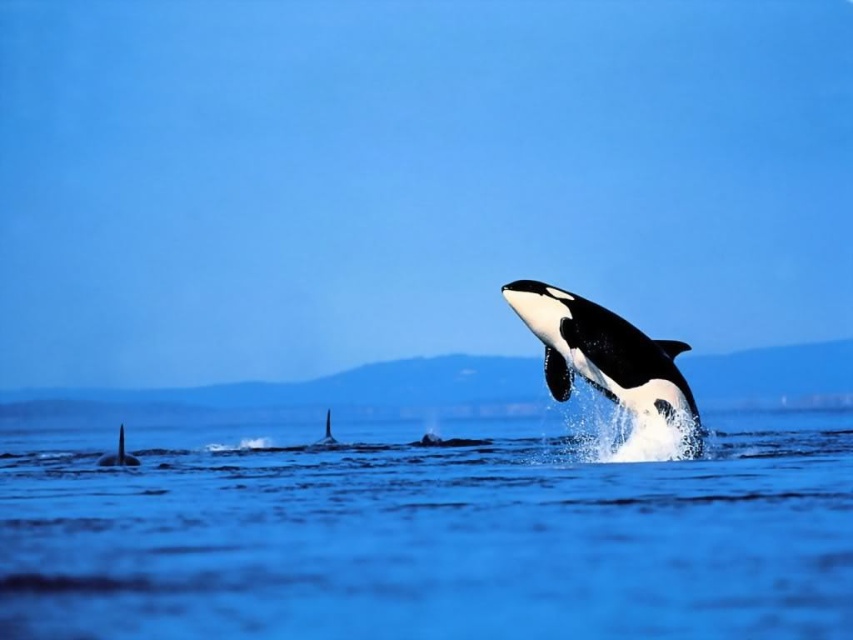
You are a marine biologist observing the orcas in the image. You notice the blue water at center and the black smooth fin at left. Which object is located above the other?

The blue water at center is positioned over the black smooth fin at left, meaning the water is above the fin.

You are a marine biologist observing the orcas in the image. You notice two points marked on the orcas. Which point is closer to the observer? The points are point (132, 456) and point (329, 438).

Point (132, 456) is in front of point (329, 438), so it is closer to the observer.